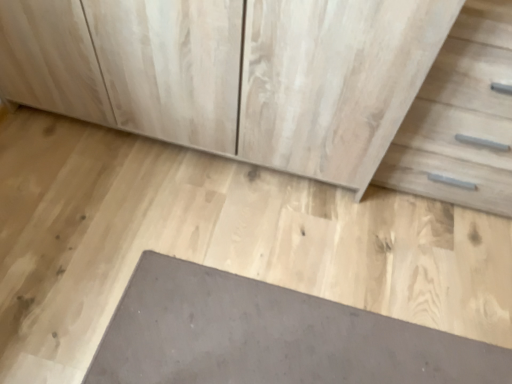
Image resolution: width=512 pixels, height=384 pixels. I want to click on free point above slate at lower center (from a real-world perspective), so click(x=283, y=338).